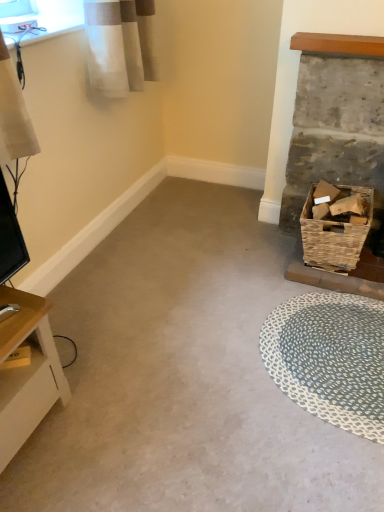
Question: From the image's perspective, is light wood table at lower left below blue woven mat at lower right?

Choices:
 (A) no
 (B) yes

Answer: (B)

Question: Is light wood table at lower left shorter than blue woven mat at lower right?

Choices:
 (A) yes
 (B) no

Answer: (B)

Question: Is light wood table at lower left outside blue woven mat at lower right?

Choices:
 (A) no
 (B) yes

Answer: (B)

Question: Could you tell me if light wood table at lower left is turned towards blue woven mat at lower right?

Choices:
 (A) no
 (B) yes

Answer: (A)

Question: From a real-world perspective, is light wood table at lower left on blue woven mat at lower right?

Choices:
 (A) no
 (B) yes

Answer: (B)

Question: Can you confirm if light wood table at lower left is thinner than blue woven mat at lower right?

Choices:
 (A) no
 (B) yes

Answer: (B)

Question: Does woven brown basket at right come behind blue woven mat at lower right?

Choices:
 (A) no
 (B) yes

Answer: (B)

Question: Does woven brown basket at right have a lesser width compared to blue woven mat at lower right?

Choices:
 (A) yes
 (B) no

Answer: (A)

Question: Could you tell me if woven brown basket at right is facing blue woven mat at lower right?

Choices:
 (A) yes
 (B) no

Answer: (A)

Question: Can you see woven brown basket at right touching blue woven mat at lower right?

Choices:
 (A) yes
 (B) no

Answer: (B)

Question: Does woven brown basket at right have a lesser height compared to blue woven mat at lower right?

Choices:
 (A) yes
 (B) no

Answer: (B)

Question: Does woven brown basket at right appear on the left side of blue woven mat at lower right?

Choices:
 (A) yes
 (B) no

Answer: (B)

Question: Does woven brown basket at right have a greater width compared to rustic wicker basket at right?

Choices:
 (A) no
 (B) yes

Answer: (B)